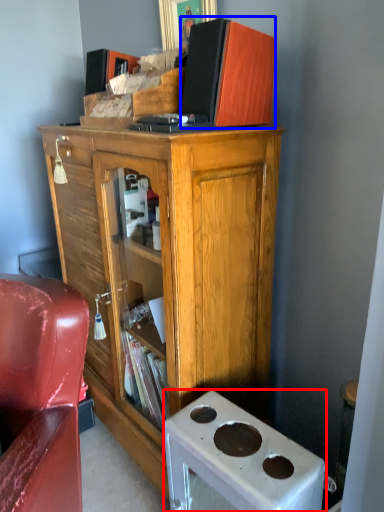
Question: Which object appears closest to the camera in this image, desk (highlighted by a red box) or book (highlighted by a blue box)?

Choices:
 (A) desk
 (B) book

Answer: (A)